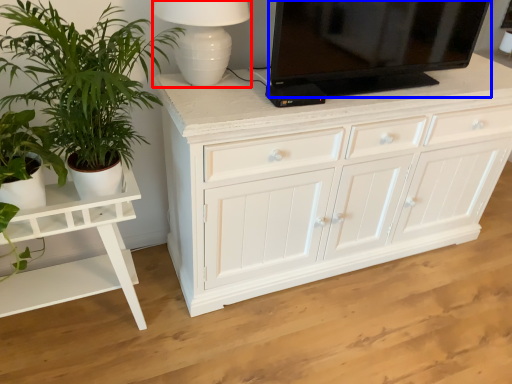
Question: Among these objects, which one is nearest to the camera, table lamp (highlighted by a red box) or television (highlighted by a blue box)?

Choices:
 (A) table lamp
 (B) television

Answer: (A)